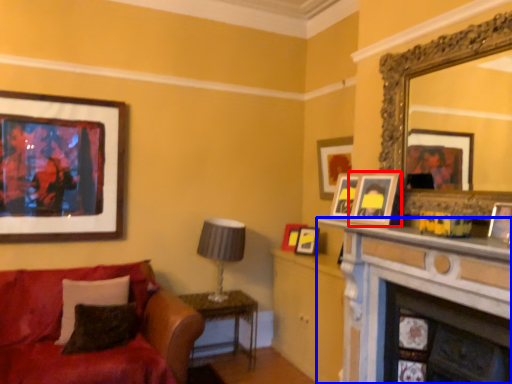
Question: Which object is further to the camera taking this photo, picture frame (highlighted by a red box) or fireplace (highlighted by a blue box)?

Choices:
 (A) picture frame
 (B) fireplace

Answer: (A)